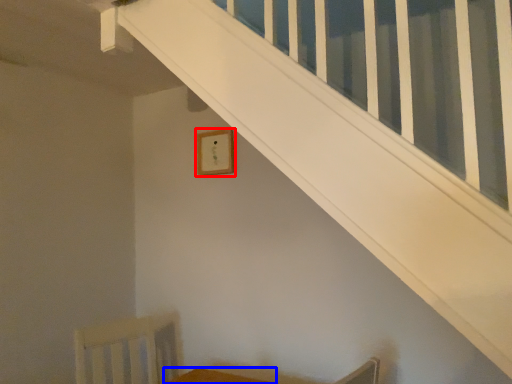
Question: Which object is further to the camera taking this photo, picture frame (highlighted by a red box) or furniture (highlighted by a blue box)?

Choices:
 (A) picture frame
 (B) furniture

Answer: (A)